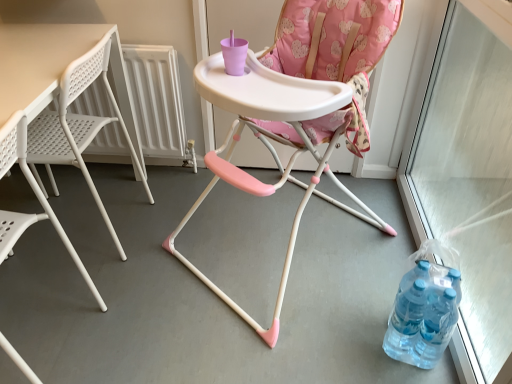
Locate an element on the screen. This screenshot has width=512, height=384. vacant space in pink plastic highchair at center, positioned as the 1th chair in right-to-left order (from a real-world perspective) is located at coordinates (281, 244).